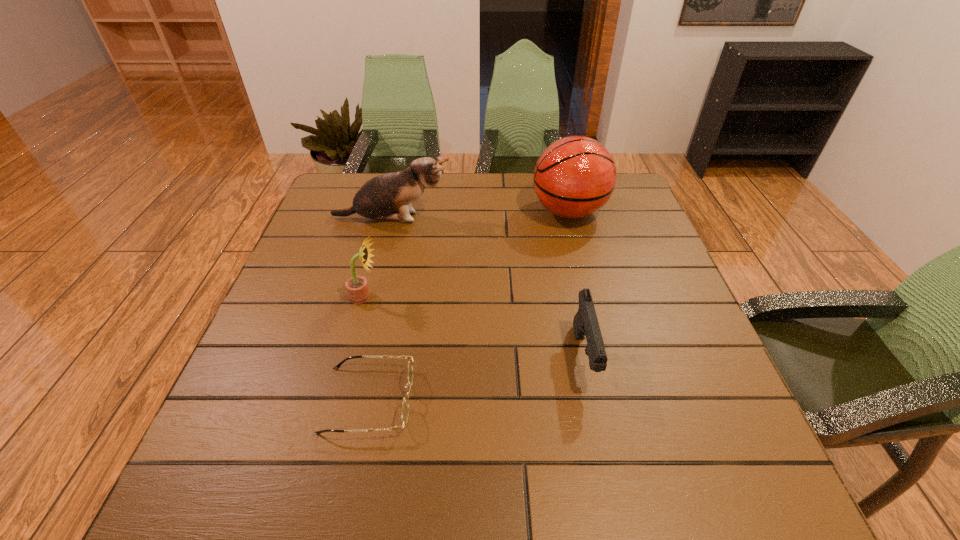
Locate an element on the screen. This screenshot has height=540, width=960. free space that is in between the spectacles and the cat is located at coordinates (380, 309).

You are a GUI agent. You are given a task and a screenshot of the screen. Output one action in this format:
    pyautogui.click(x=<x>, y=<y>)
    Task: Click on the vacant space in between the cat and the tallest object
    
    Given the screenshot: What is the action you would take?
    pyautogui.click(x=480, y=215)

At what (x,y) coordinates should I click in order to perform the action: click on free space between the cat and the pistol. Please return your answer as a coordinate pair (x, y). Looking at the image, I should click on (488, 288).

Identify which object is the fourth nearest to the second shortest object. Please provide its 2D coordinates. Your answer should be formatted as a tuple, i.e. [(x, y)], where the tuple contains the x and y coordinates of a point satisfying the conditions above.

[(388, 196)]

Find the location of a particular element. This screenshot has width=960, height=540. object that can be found as the fourth closest to the cat is located at coordinates (405, 405).

Identify the location of vacant region that satisfies the following two spatial constraints: 1. at the barrel of the fourth tallest object; 2. on the lenses of the spectacles. The image size is (960, 540). (592, 400).

Find the location of `vacant space that satisfies the following two spatial constraints: 1. at the barrel of the fourth tallest object; 2. on the lenses of the spectacles`. vacant space that satisfies the following two spatial constraints: 1. at the barrel of the fourth tallest object; 2. on the lenses of the spectacles is located at coordinates (592, 400).

Where is `vacant space that satisfies the following two spatial constraints: 1. at the barrel of the fourth tallest object; 2. on the lenses of the shortest object`? This screenshot has height=540, width=960. vacant space that satisfies the following two spatial constraints: 1. at the barrel of the fourth tallest object; 2. on the lenses of the shortest object is located at coordinates (592, 400).